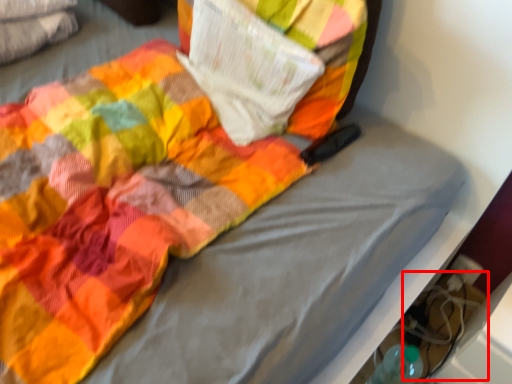
Question: From the image's perspective, considering the relative positions of footwear (annotated by the red box) and paperback book in the image provided, where is footwear (annotated by the red box) located with respect to the staircase?

Choices:
 (A) below
 (B) above

Answer: (A)